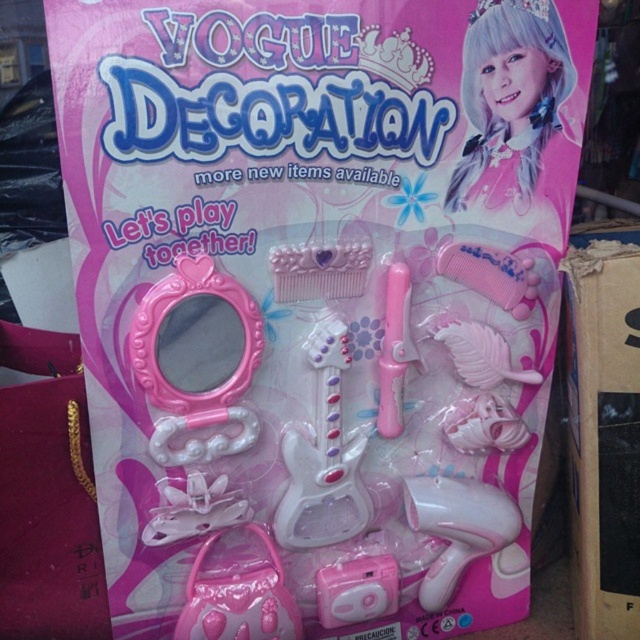
From the picture: Can you confirm if pink plastic hair clip at lower center is taller than pink plastic comb at upper center?

Yes.

Between pink plastic hair clip at lower center and pink plastic comb at upper center, which one is positioned higher?

pink plastic comb at upper center is higher up.

The height and width of the screenshot is (640, 640). What do you see at coordinates (237, 592) in the screenshot? I see `pink plastic hair clip at lower center` at bounding box center [237, 592].

Locate an element on the screen. The image size is (640, 640). pink plastic hair clip at lower center is located at coordinates (237, 592).

Who is higher up, pink plastic mirror at center or pink plastic comb at center-right?

Positioned higher is pink plastic comb at center-right.

Can you confirm if pink plastic mirror at center is shorter than pink plastic comb at center-right?

No, pink plastic mirror at center is not shorter than pink plastic comb at center-right.

Who is more distant from viewer, (172, 436) or (516, 266)?

Point (516, 266)

I want to click on pink plastic mirror at center, so click(196, 358).

Does pink plastic hair clip at lower center come in front of pink plastic camera at center?

Yes, it is in front of pink plastic camera at center.

Based on the photo, who is positioned more to the right, pink plastic hair clip at lower center or pink plastic camera at center?

Positioned to the right is pink plastic camera at center.

Who is more forward, (200, 584) or (394, 561)?

Positioned in front is point (200, 584).

Find the location of `pink plastic hair clip at lower center`. pink plastic hair clip at lower center is located at coordinates (237, 592).